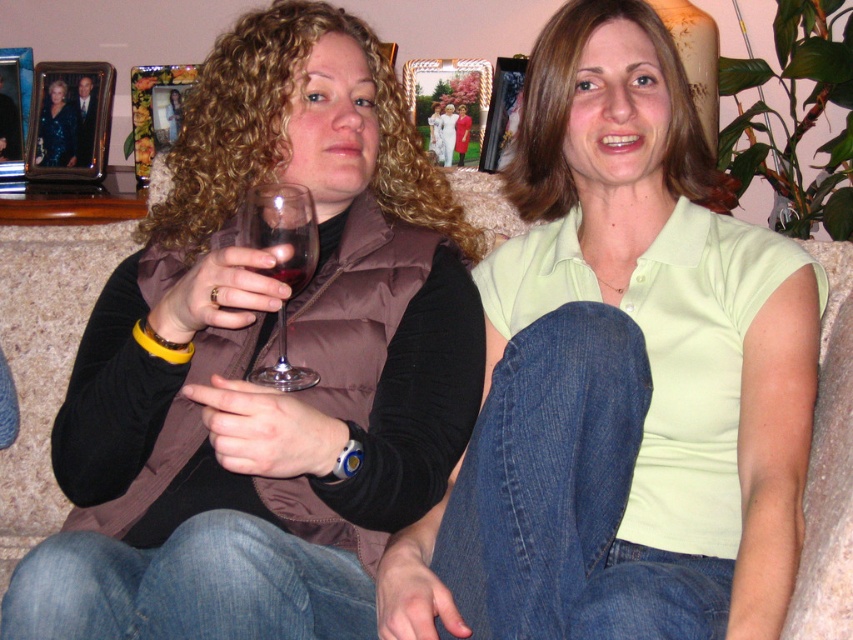
Question: Among these objects, which one is farthest from the camera?

Choices:
 (A) metallic silver picture frame at upper left
 (B) floral-patterned wood picture frame at upper left

Answer: (A)

Question: Observing the image, what is the correct spatial positioning of light green cotton shirt at center in reference to metallic silver picture frame at upper center?

Choices:
 (A) left
 (B) right

Answer: (B)

Question: Which point appears closest to the camera in this image?

Choices:
 (A) (131, 474)
 (B) (263, 205)

Answer: (B)

Question: Is brown satin vest at center to the left of brushed metal picture frame at upper left from the viewer's perspective?

Choices:
 (A) yes
 (B) no

Answer: (B)

Question: Can you confirm if light green cotton shirt at center is thinner than floral-patterned wood picture frame at upper left?

Choices:
 (A) yes
 (B) no

Answer: (B)

Question: Estimate the real-world distances between objects in this image. Which object is farther from the metallic photo frame at center?

Choices:
 (A) brown satin vest at center
 (B) metallic silver picture frame at upper left
 (C) metallic silver picture frame at upper center

Answer: (A)